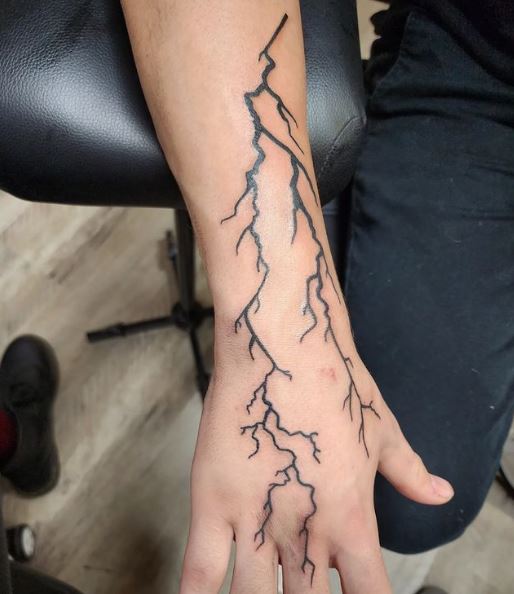
The width and height of the screenshot is (514, 594). I want to click on caster, so click(x=27, y=542).